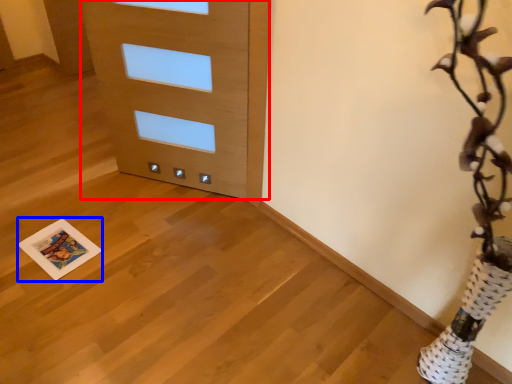
Question: Which point is closer to the camera, door (highlighted by a red box) or print (highlighted by a blue box)?

Choices:
 (A) door
 (B) print

Answer: (A)